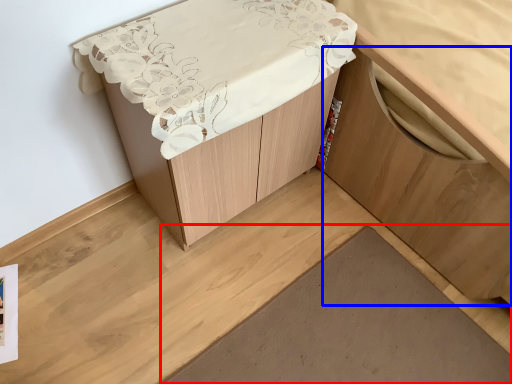
Question: Which point is further to the camera, plank (highlighted by a red box) or cabinetry (highlighted by a blue box)?

Choices:
 (A) plank
 (B) cabinetry

Answer: (A)